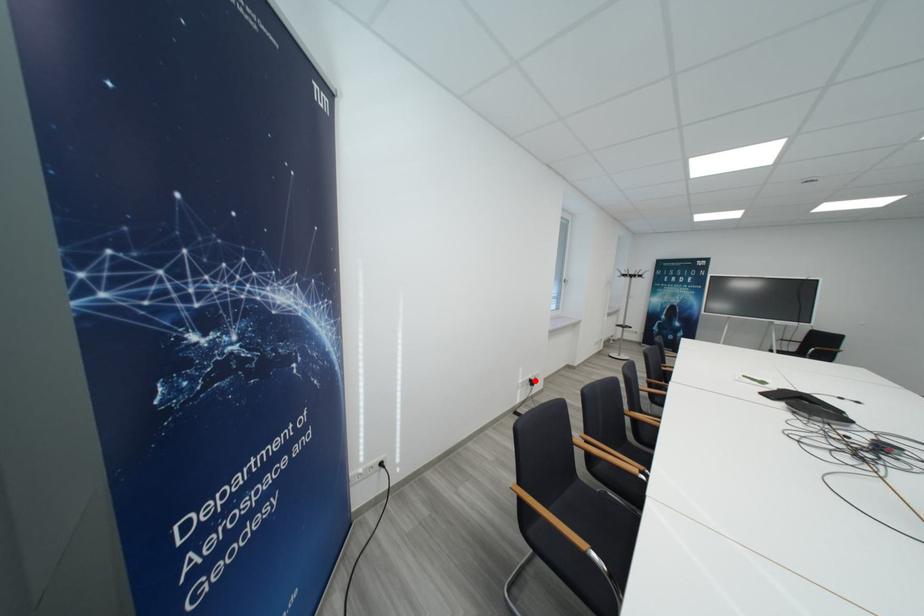
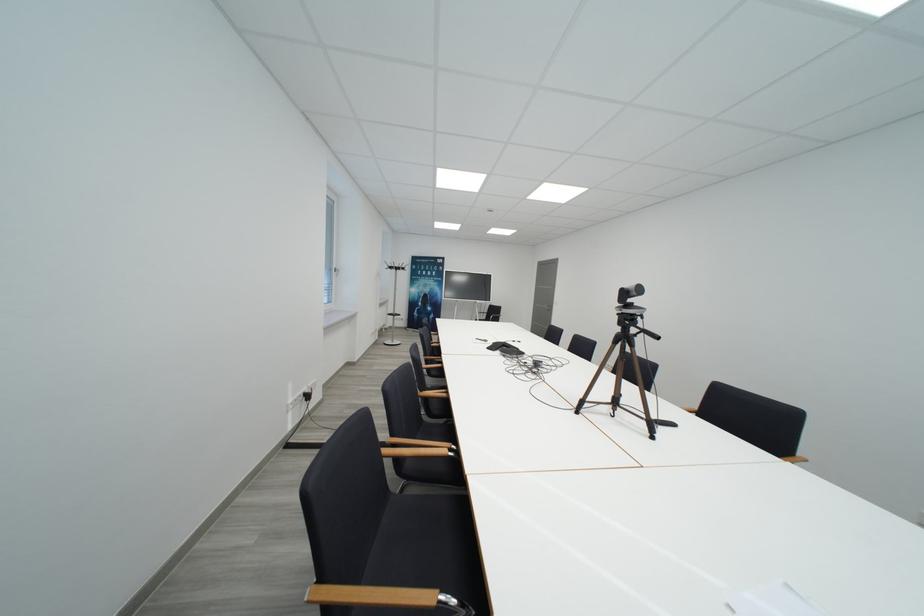
Question: I am providing you with two images of the same scene from different viewpoints. In image1, a red point is highlighted. Considering the same 3D point in image2, which of the following is correct?

Choices:
 (A) It is closer
 (B) It is farther

Answer: (A)